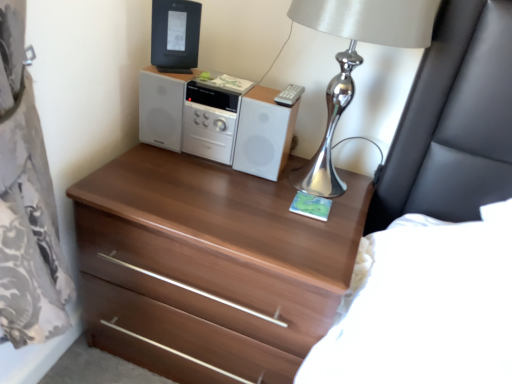
Question: Looking at their shapes, would you say black plastic desktop computer at upper center is wider or thinner than white glossy stereo at center?

Choices:
 (A) thin
 (B) wide

Answer: (A)

Question: Is black plastic desktop computer at upper center in front of or behind white glossy stereo at center in the image?

Choices:
 (A) behind
 (B) front

Answer: (A)

Question: Estimate the real-world distances between objects in this image. Which object is closer to the walnut wood chest of drawers at center?

Choices:
 (A) silver metallic table lamp at upper right
 (B) black plastic desktop computer at upper center
 (C) white glossy stereo at center

Answer: (C)

Question: Which object is the farthest from the walnut wood chest of drawers at center?

Choices:
 (A) silver metallic table lamp at upper right
 (B) black plastic desktop computer at upper center
 (C) white glossy stereo at center

Answer: (B)